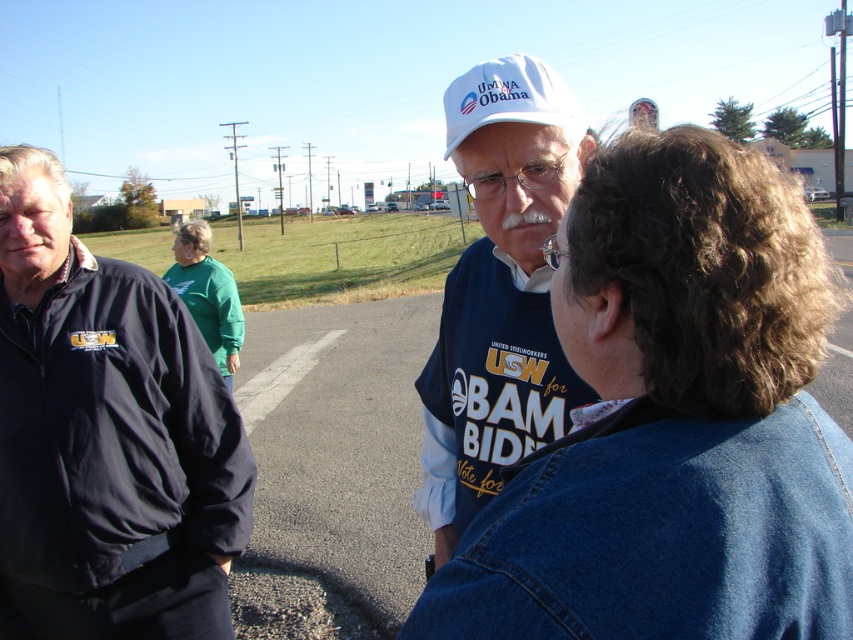
Does denim jacket at upper right have a smaller size compared to dark blue jacket at left?

Correct, denim jacket at upper right occupies less space than dark blue jacket at left.

Does point (717, 355) come in front of point (39, 620)?

Yes, it is.

Where is `denim jacket at upper right`? The image size is (853, 640). denim jacket at upper right is located at coordinates (674, 420).

Does denim jacket at upper right have a lesser height compared to white matte hat at center?

Indeed, denim jacket at upper right has a lesser height compared to white matte hat at center.

Does point (679, 401) come behind point (502, 456)?

No, (679, 401) is closer to viewer.

Who is more forward, (799, 381) or (521, 365)?

Point (799, 381) is more forward.

In order to click on denim jacket at upper right in this screenshot , I will do `click(674, 420)`.

Between white matte hat at center and white matte baseball hat at upper center, which one is positioned higher?

Positioned higher is white matte baseball hat at upper center.

Is white matte hat at center bigger than white matte baseball hat at upper center?

Actually, white matte hat at center might be smaller than white matte baseball hat at upper center.

Measure the distance between white matte hat at center and camera.

white matte hat at center and camera are 4.00 feet apart from each other.

Where is `white matte hat at center`? The height and width of the screenshot is (640, 853). white matte hat at center is located at coordinates (498, 291).